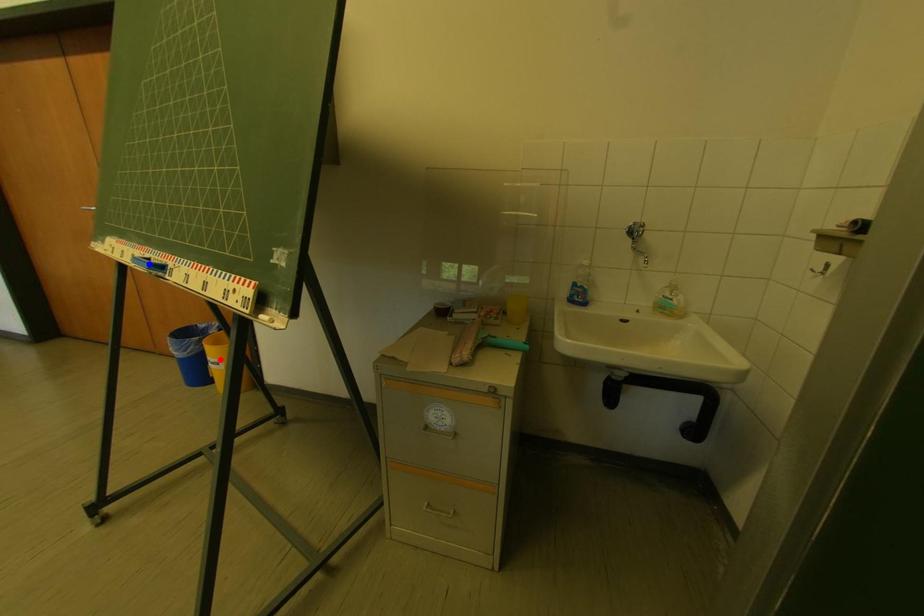
Question: In the image, two points are highlighted. Which point is nearer to the camera? Reply with the corresponding letter.

Choices:
 (A) blue point
 (B) red point

Answer: (A)